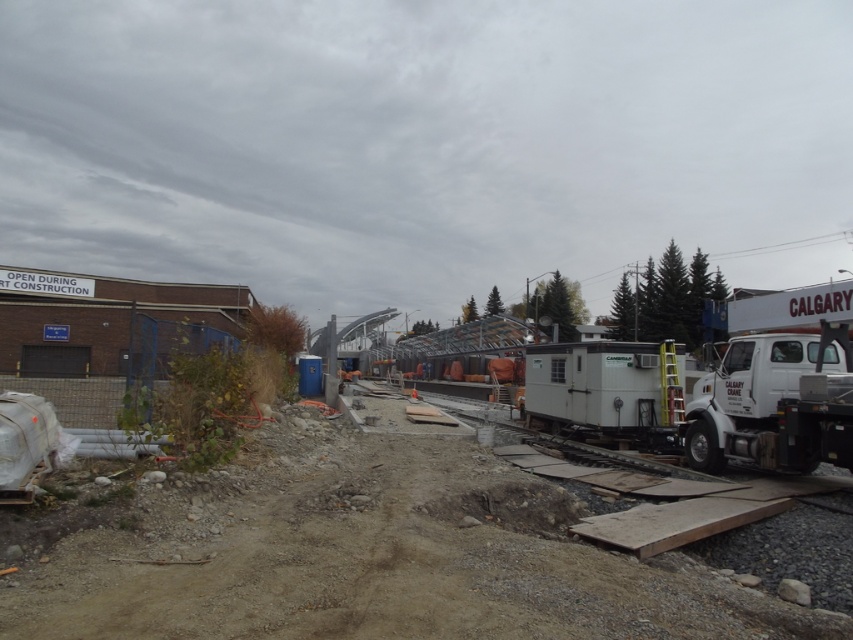
Question: Estimate the real-world distances between objects in this image. Which object is closer to the white matte trailer truck at center?

Choices:
 (A) white matte trailer truck at right
 (B) white metal trailer at center

Answer: (A)

Question: Which object is the closest to the white matte trailer truck at right?

Choices:
 (A) white metal trailer at center
 (B) white matte trailer truck at center

Answer: (B)

Question: Which point is farther to the camera?

Choices:
 (A) (314, 598)
 (B) (604, 428)

Answer: (B)

Question: Does white matte trailer truck at right have a lesser width compared to white matte trailer truck at center?

Choices:
 (A) no
 (B) yes

Answer: (B)

Question: Can you confirm if white metal trailer at center is wider than white matte trailer truck at right?

Choices:
 (A) yes
 (B) no

Answer: (A)

Question: Is white matte trailer truck at right below white matte trailer truck at center?

Choices:
 (A) yes
 (B) no

Answer: (B)